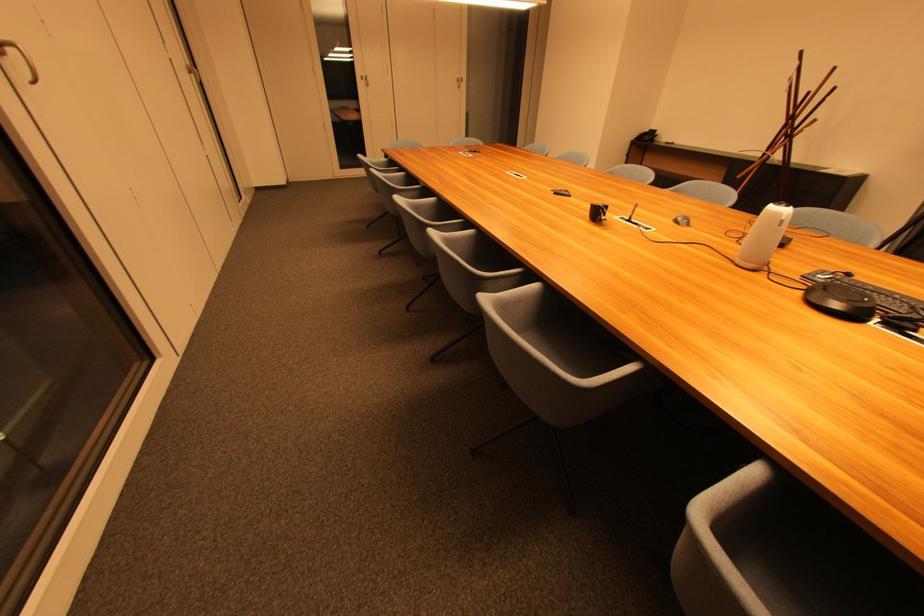
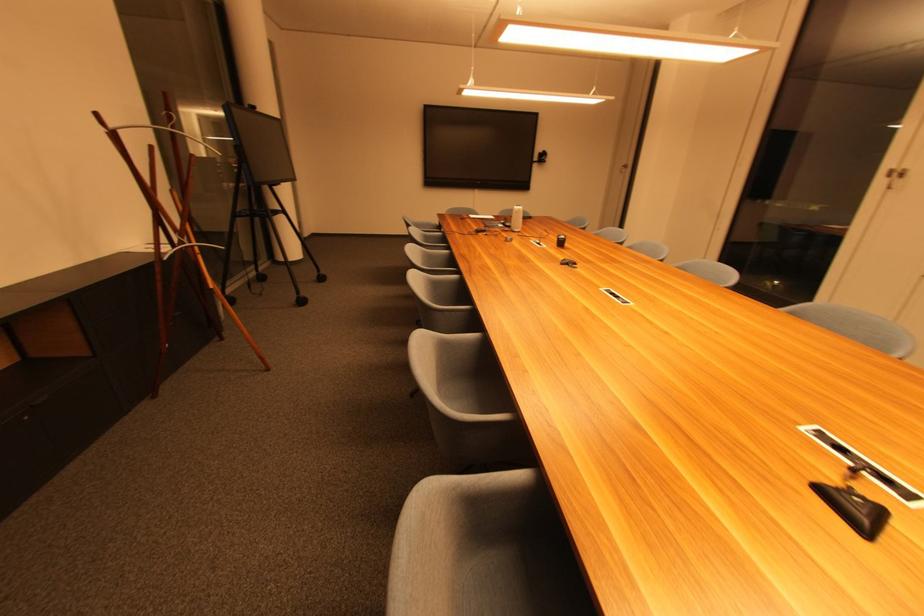
The point at [744,179] is marked in the first image. Where is the corresponding point in the second image?

(216, 288)